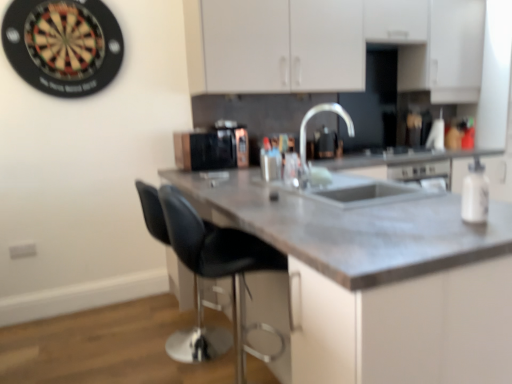
Locate an element on the screen. vacant region to the right of satin nickel faucet at center is located at coordinates (355, 187).